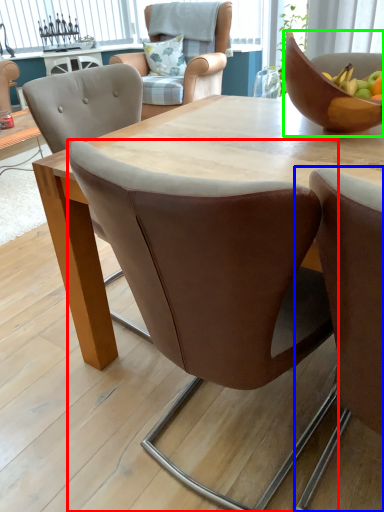
Question: Which is farther away from chair (highlighted by a red box)? chair (highlighted by a blue box) or bowl (highlighted by a green box)?

Choices:
 (A) chair
 (B) bowl

Answer: (B)